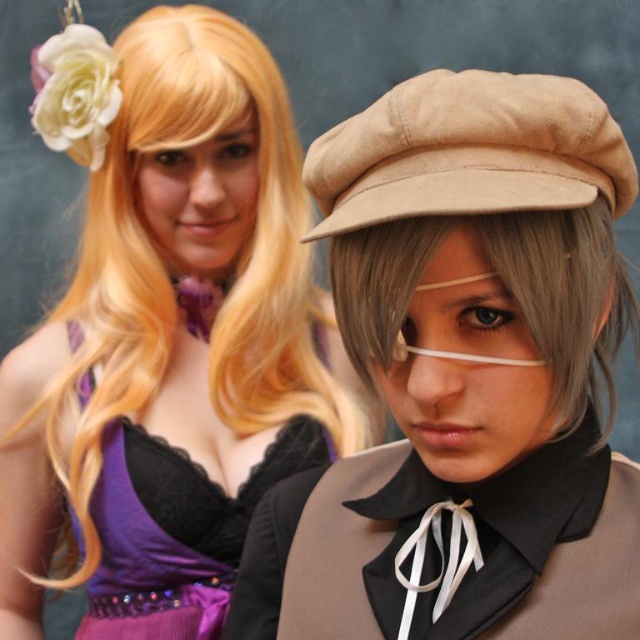
Is matte blonde wig at upper left closer to the viewer compared to gray matte wig at center?

No, it is behind gray matte wig at center.

Is point (164, 417) closer to viewer compared to point (563, 253)?

That is False.

The width and height of the screenshot is (640, 640). I want to click on matte blonde wig at upper left, so click(172, 346).

Is matte blonde wig at upper left bigger than suede beige beret at center?

Correct, matte blonde wig at upper left is larger in size than suede beige beret at center.

Who is positioned more to the right, matte blonde wig at upper left or suede beige beret at center?

suede beige beret at center

Is point (250, 276) in front of point (540, 168)?

That is False.

Image resolution: width=640 pixels, height=640 pixels. I want to click on matte blonde wig at upper left, so pos(172,346).

Is point (516, 211) more distant than point (568, 234)?

No, (516, 211) is closer to viewer.

Is suede beige beret at center thinner than gray matte wig at center?

In fact, suede beige beret at center might be wider than gray matte wig at center.

Is point (321, 188) more distant than point (586, 353)?

Yes, point (321, 188) is farther from viewer.

Where is `suede beige beret at center`? This screenshot has width=640, height=640. suede beige beret at center is located at coordinates (468, 150).